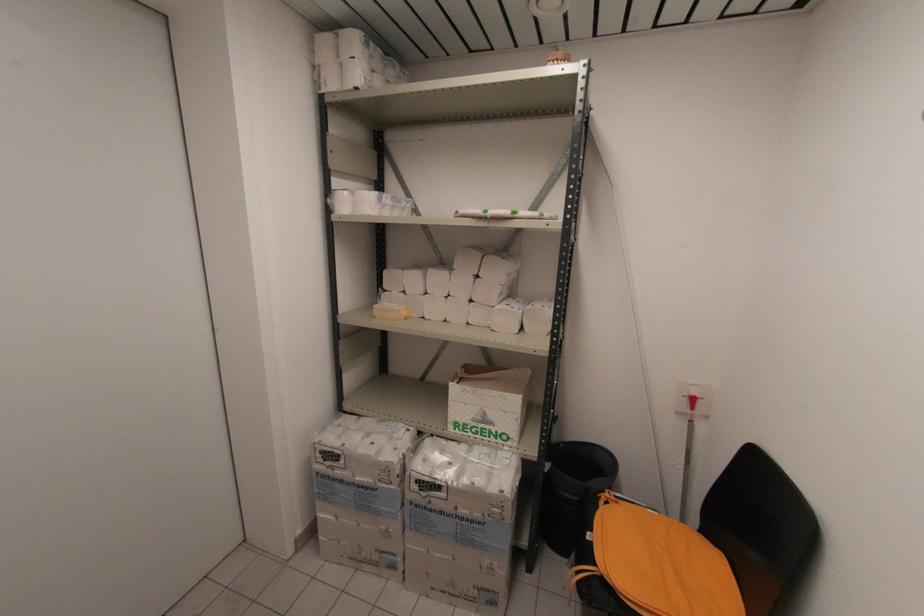
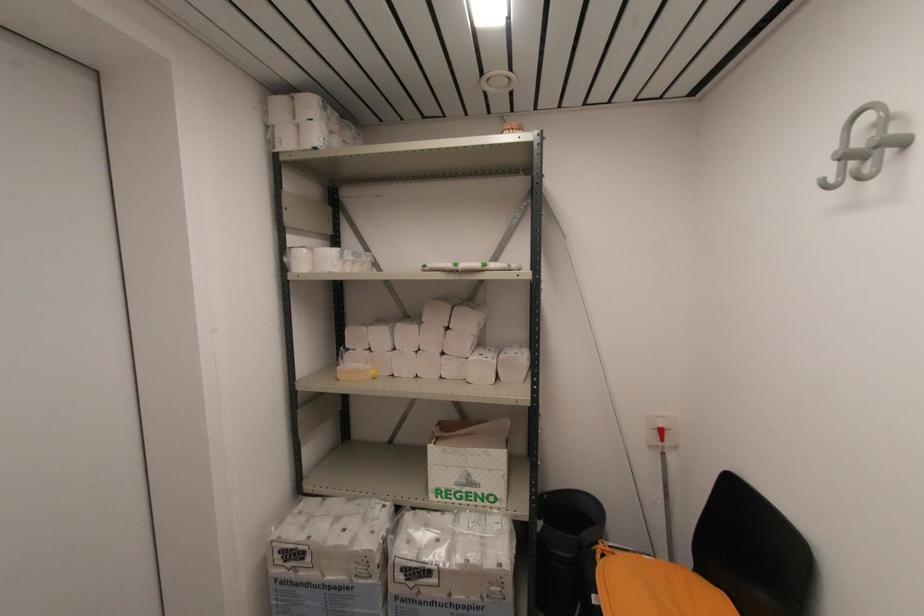
In the second image, find the point that corresponds to [353,87] in the first image.

(310, 148)